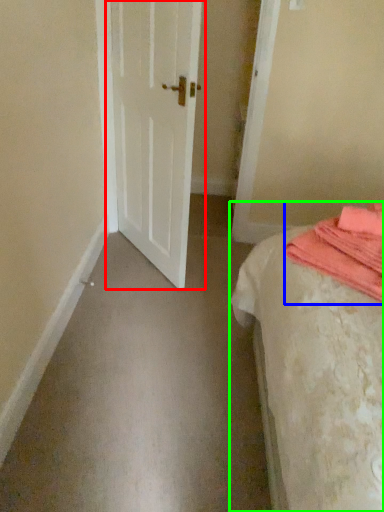
Question: Which object is positioned farthest from door (highlighted by a red box)? Select from blanket (highlighted by a blue box) and bed (highlighted by a green box).

Choices:
 (A) blanket
 (B) bed

Answer: (A)